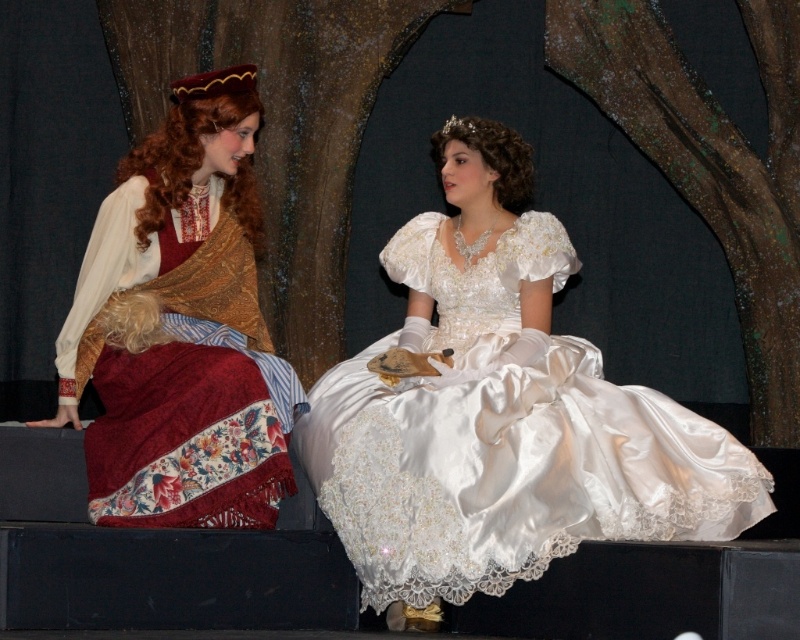
You are an audience member sitting in the front row of the theater. You notice two points marked on the stage where the performers are standing. The first point is at coordinates point(448, 483) and the second is at point(150, 307). Which of these two points is closer to your seat?

Point(448, 483) is closer to the viewer than point(150, 307), so the first point is closer to your seat.